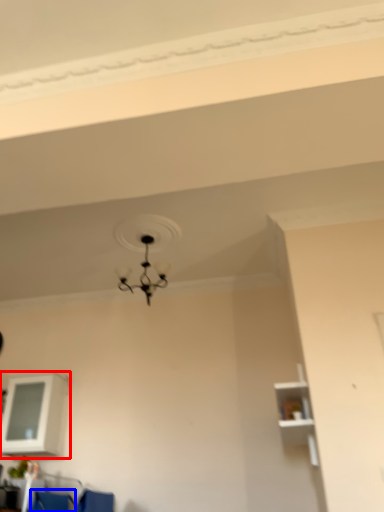
Question: Which of the following is the farthest to the observer, shelf (highlighted by a red box) or armchair (highlighted by a blue box)?

Choices:
 (A) shelf
 (B) armchair

Answer: (A)